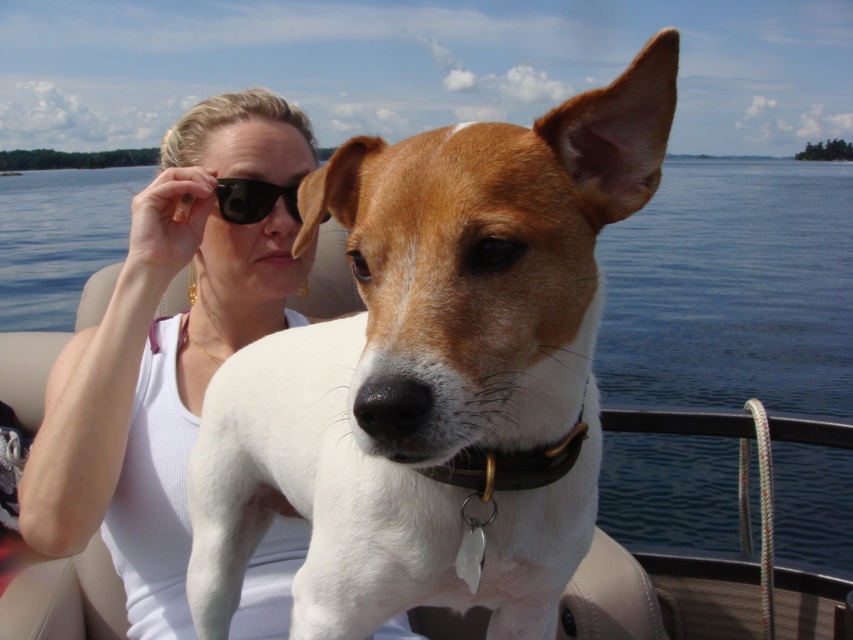
Is white fur dog at center to the right of blue water at center from the viewer's perspective?

Correct, you'll find white fur dog at center to the right of blue water at center.

Does white fur dog at center have a greater width compared to blue water at center?

No.

Does point (485, 371) lie behind point (676, 268)?

No, it is not.

Where is `white fur dog at center`? Image resolution: width=853 pixels, height=640 pixels. white fur dog at center is located at coordinates (433, 372).

Can you confirm if white fur dog at center is smaller than white fabric tank top at center?

Yes, white fur dog at center is smaller than white fabric tank top at center.

Which of these two, white fur dog at center or white fabric tank top at center, stands taller?

With more height is white fabric tank top at center.

Is point (537, 228) farther from viewer compared to point (247, 109)?

No, it is not.

Locate an element on the screen. This screenshot has width=853, height=640. white fur dog at center is located at coordinates (433, 372).

Does white fabric tank top at center come in front of black plastic sunglasses at upper center?

That is True.

Which is in front, point (287, 141) or point (218, 180)?

Positioned in front is point (218, 180).

Identify the location of white fabric tank top at center. This screenshot has height=640, width=853. (166, 353).